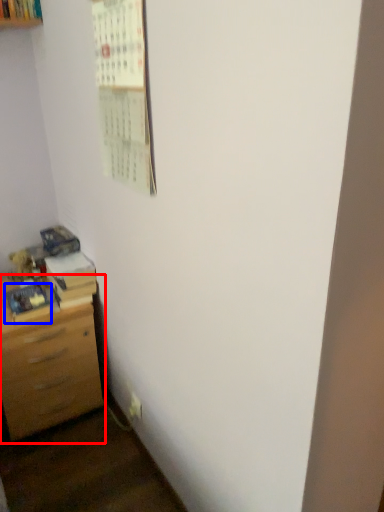
Question: Which object appears closest to the camera in this image, chest of drawers (highlighted by a red box) or book (highlighted by a blue box)?

Choices:
 (A) chest of drawers
 (B) book

Answer: (A)